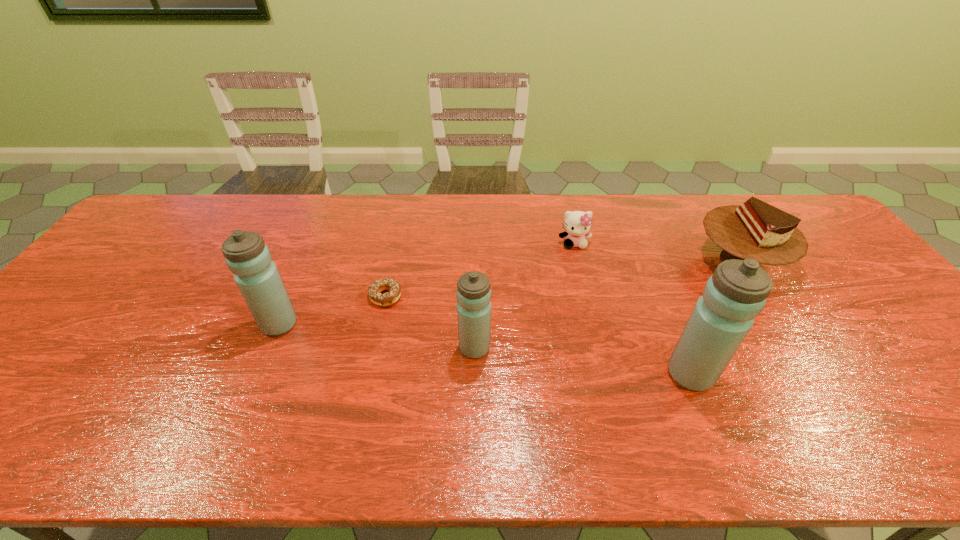
You are a GUI agent. You are given a task and a screenshot of the screen. Output one action in this format:
    pyautogui.click(x=<x>, y=<y>)
    Task: Click on the second object from left to right
    The height and width of the screenshot is (540, 960).
    Given the screenshot: What is the action you would take?
    pyautogui.click(x=374, y=289)

Locate an element on the screen. The width and height of the screenshot is (960, 540). vacant region located 0.390m on the back of the fifth shortest object is located at coordinates (323, 222).

Locate an element on the screen. vacant space located on the left of the fourth shortest object is located at coordinates (426, 348).

This screenshot has height=540, width=960. In order to click on free space located 0.090m on the back of the second object from right to left in this screenshot , I will do `click(671, 326)`.

Find the location of a particular element. free spot located on the front-facing side of the kitten is located at coordinates (585, 288).

Identify the location of free spot located on the right of the rightmost object. This screenshot has height=540, width=960. (809, 260).

This screenshot has width=960, height=540. I want to click on free space located on the left of the fifth object from right to left, so click(x=241, y=296).

Identify the location of kitten present at the far edge. This screenshot has width=960, height=540. (577, 224).

The image size is (960, 540). In order to click on cake that is at the far edge in this screenshot , I will do `click(757, 230)`.

Locate an element on the screen. This screenshot has width=960, height=540. object at the near edge is located at coordinates (736, 293).